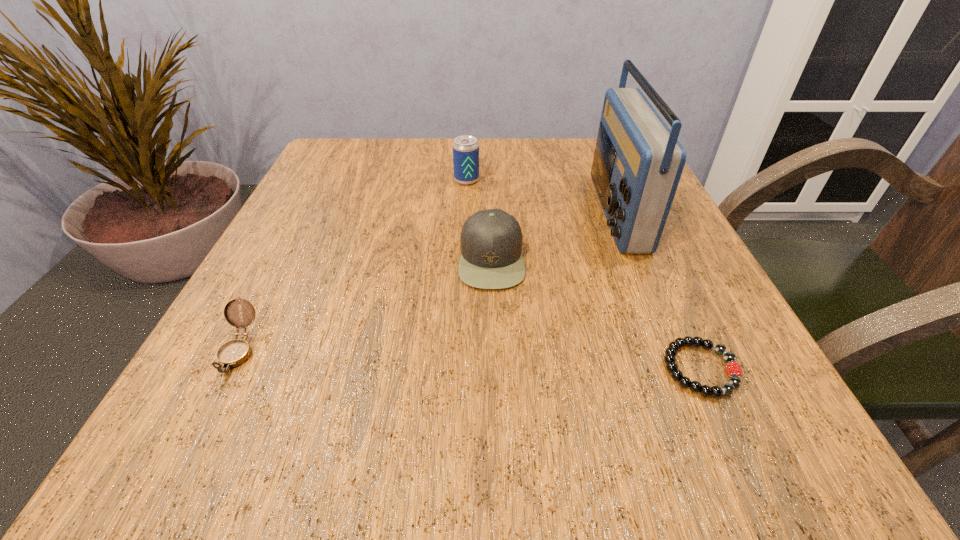
Identify the location of free space that satisfies the following two spatial constraints: 1. on the front side of the beer can; 2. on the right side of the bracelet. The height and width of the screenshot is (540, 960). (458, 369).

You are a GUI agent. You are given a task and a screenshot of the screen. Output one action in this format:
    pyautogui.click(x=<x>, y=<y>)
    Task: Click on the vacant space that satisfies the following two spatial constraints: 1. on the front panel of the radio receiver; 2. on the right side of the shortest object
    This screenshot has height=540, width=960.
    Given the screenshot: What is the action you would take?
    pyautogui.click(x=680, y=369)

Where is `blank space that satisfies the following two spatial constraints: 1. on the brim of the cap; 2. on the right side of the bracelet`? blank space that satisfies the following two spatial constraints: 1. on the brim of the cap; 2. on the right side of the bracelet is located at coordinates (494, 369).

This screenshot has height=540, width=960. Identify the location of vacant space that satisfies the following two spatial constraints: 1. on the brim of the cap; 2. on the right side of the shortest object. pyautogui.click(x=494, y=369).

Identify the location of vacant point that satisfies the following two spatial constraints: 1. on the brim of the third shortest object; 2. on the left side of the shortest object. (494, 369).

Image resolution: width=960 pixels, height=540 pixels. In order to click on free point that satisfies the following two spatial constraints: 1. on the back side of the bracelet; 2. on the brim of the cap in this screenshot , I will do `click(651, 259)`.

Where is `free space that satisfies the following two spatial constraints: 1. on the brim of the bracelet; 2. on the left side of the cap`? Image resolution: width=960 pixels, height=540 pixels. free space that satisfies the following two spatial constraints: 1. on the brim of the bracelet; 2. on the left side of the cap is located at coordinates (494, 369).